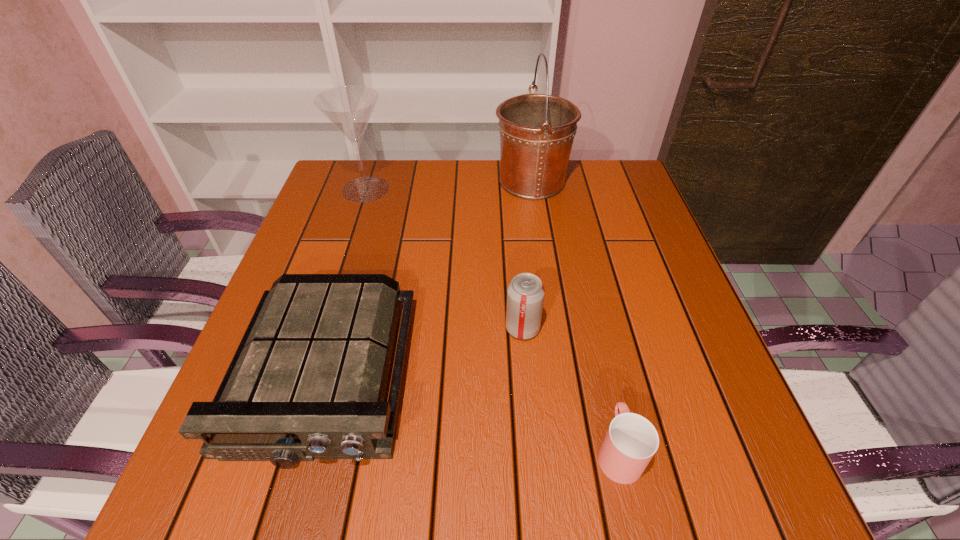
The image size is (960, 540). Identify the location of free space at the near edge of the desktop. (566, 468).

This screenshot has width=960, height=540. In the image, there is a desktop. Find the location of `vacant space at the left edge`. vacant space at the left edge is located at coordinates (370, 228).

This screenshot has height=540, width=960. In the image, there is a desktop. What are the coordinates of `vacant space at the right edge` in the screenshot? It's located at (693, 435).

The image size is (960, 540). In the image, there is a desktop. What are the coordinates of `free space at the far right corner` in the screenshot? It's located at (624, 195).

Locate an element on the screen. This screenshot has height=540, width=960. vacant space that's between the third tallest object and the cup is located at coordinates (570, 390).

Locate an element on the screen. Image resolution: width=960 pixels, height=540 pixels. blank region between the soda can and the flute glass is located at coordinates (444, 259).

At what (x,y) coordinates should I click in order to perform the action: click on vacant area that lies between the soda can and the radio receiver. Please return your answer as a coordinate pair (x, y). This screenshot has width=960, height=540. Looking at the image, I should click on (422, 352).

The width and height of the screenshot is (960, 540). Find the location of `free space between the bucket and the soda can`. free space between the bucket and the soda can is located at coordinates (527, 255).

Image resolution: width=960 pixels, height=540 pixels. What are the coordinates of `vacant region between the radio receiver and the bucket` in the screenshot? It's located at (427, 279).

Where is `free spot between the cup and the fourth shortest object`? The image size is (960, 540). free spot between the cup and the fourth shortest object is located at coordinates (492, 320).